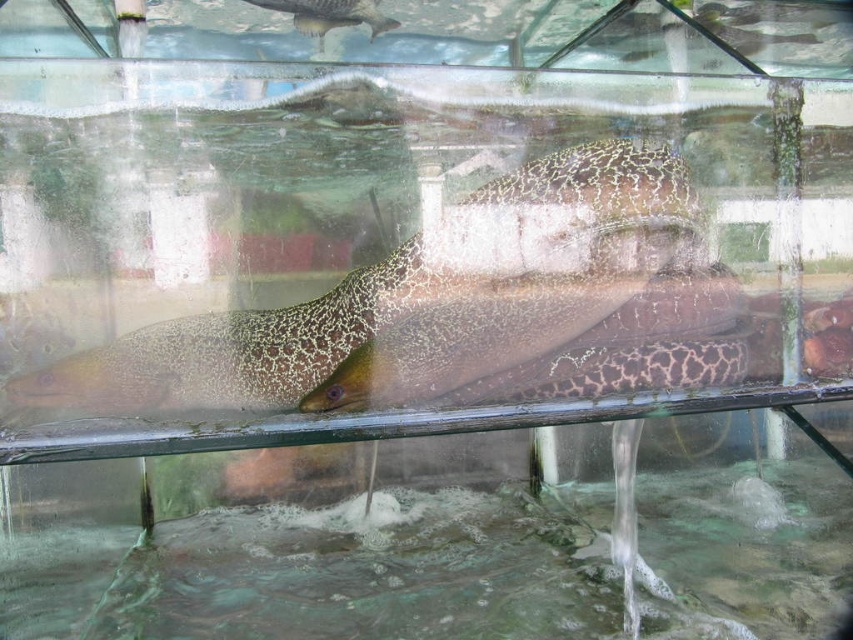
Does point (555, 634) come behind point (329, 16)?

No, (555, 634) is closer to viewer.

Is clear water at bottom below shiny silver fish at upper center?

Indeed, clear water at bottom is positioned under shiny silver fish at upper center.

What are the coordinates of `clear water at bottom` in the screenshot? It's located at (325, 573).

Where is `clear water at bottom`? clear water at bottom is located at coordinates (325, 573).

Does speckled skin eel at center appear on the left side of shiny silver fish at upper center?

No, speckled skin eel at center is not to the left of shiny silver fish at upper center.

Identify the location of speckled skin eel at center. (416, 291).

The image size is (853, 640). Identify the location of speckled skin eel at center. (416, 291).

The image size is (853, 640). In order to click on speckled skin eel at center in this screenshot , I will do `click(416, 291)`.

Is clear water at bottom positioned in front of speckled skin eel at center?

No, it is not.

Is clear water at bottom wider than speckled skin eel at center?

Yes, clear water at bottom is wider than speckled skin eel at center.

Does point (80, 620) come in front of point (380, 332)?

No, (80, 620) is behind (380, 332).

Identify the location of clear water at bottom. (325, 573).